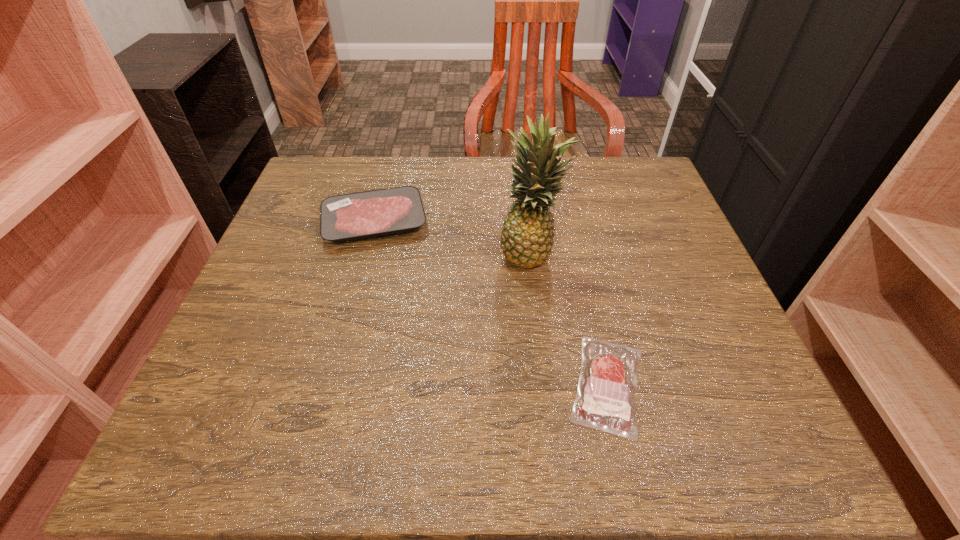
Where is `vacant point located between the pineapple and the left steak`? This screenshot has width=960, height=540. vacant point located between the pineapple and the left steak is located at coordinates (453, 238).

Identify the location of free space between the nearer steak and the pineapple. (569, 319).

At what (x,y) coordinates should I click in order to perform the action: click on vacant point located between the left steak and the nearest object. Please return your answer as a coordinate pair (x, y). This screenshot has width=960, height=540. Looking at the image, I should click on (491, 303).

Find the location of a particular element. free area in between the pineapple and the shorter steak is located at coordinates (569, 319).

Locate an element on the screen. The width and height of the screenshot is (960, 540). empty space that is in between the left steak and the right steak is located at coordinates (491, 303).

Where is `empty space between the second shortest object and the pineapple`? empty space between the second shortest object and the pineapple is located at coordinates (453, 238).

Where is `vacant space that's between the shorter steak and the left steak`? vacant space that's between the shorter steak and the left steak is located at coordinates (491, 303).

This screenshot has height=540, width=960. I want to click on free space between the pineapple and the right steak, so click(x=569, y=319).

Locate an element on the screen. free spot between the left steak and the pineapple is located at coordinates (453, 238).

Where is `object that ranks as the second closest to the tallest object`? This screenshot has height=540, width=960. object that ranks as the second closest to the tallest object is located at coordinates (348, 217).